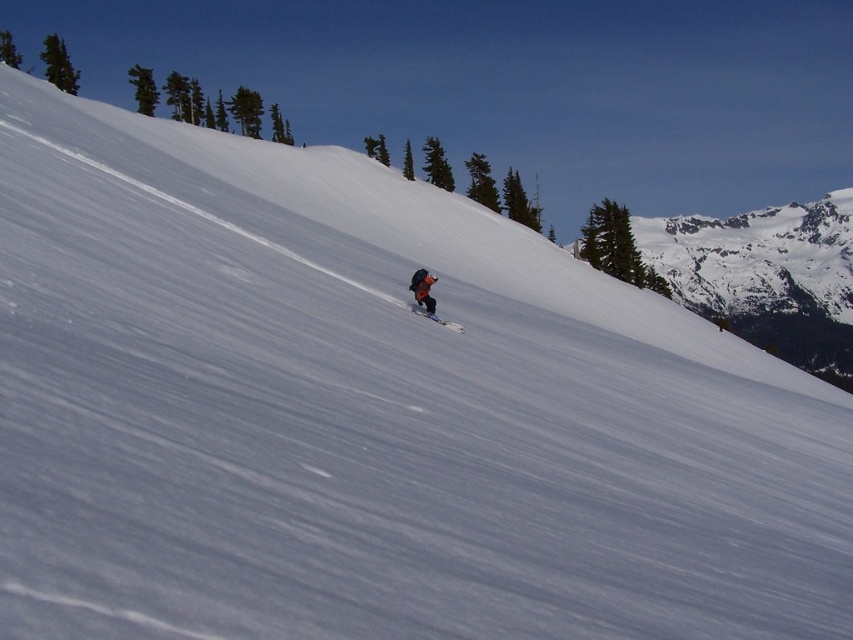
You are a photographer standing at the bottom of the slope. You want to take a photo of the matte black jacket at center and the matte orange ski at center so that both are clearly visible in the frame. Given that your camera has a minimum focus distance of 30 inches, will you be able to capture both objects in focus without moving closer?

The matte black jacket at center and matte orange ski at center are 29.43 inches apart. Since the distance between them is less than the camera minimum focus distance of 30 inches, the camera can capture both objects in focus without moving closer.

You are a photographer planning to take a photo of the matte black jacket at center and the matte orange ski at center. Which object should you focus on first to ensure both are in the frame?

The matte black jacket at center is positioned over the matte orange ski at center, so you should focus on the matte black jacket at center first to ensure both are in the frame.

You are a drone operator trying to capture the skier wearing a matte black jacket at center. The drone is currently at the point marked as point (422,289). To get a clear shot, you need to adjust the drone to the left. Which direction should you move the drone to ensure it stays within the slope area?

The point (422,289) corresponds to the matte black jacket at center. To adjust the drone to the left while staying within the slope area, move it towards the left side of the slope, ensuring it remains on the steep slope covered in pristine white snow and avoids the evergreen trees and mountain peak in the background.